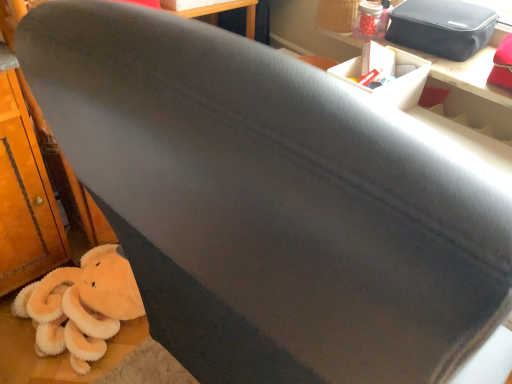
Based on the photo, in order to face white cardboard box at upper right, should I rotate leftwards or rightwards?

You should look right and rotate roughly 16.276 degrees.

At what (x,y) coordinates should I click in order to perform the action: click on matte black table at upper right. Please return your answer as a coordinate pair (x, y). Looking at the image, I should click on (466, 73).

How different are the orientations of white cardboard box at upper right and matte black table at upper right in degrees?

The facing directions of white cardboard box at upper right and matte black table at upper right are 91.3 degrees apart.

Does white cardboard box at upper right have a lesser width compared to matte black table at upper right?

Yes, white cardboard box at upper right is thinner than matte black table at upper right.

From a real-world perspective, is white cardboard box at upper right physically located above or below matte black table at upper right?

white cardboard box at upper right is situated higher than matte black table at upper right in the real world.

Is white cardboard box at upper right not near matte black table at upper right?

No, white cardboard box at upper right is not far away from matte black table at upper right.

Locate an element on the screen. table lying in front of the white cardboard box at upper right is located at coordinates (466, 73).

Can you confirm if matte black table at upper right is smaller than white cardboard box at upper right?

No, matte black table at upper right is not smaller than white cardboard box at upper right.

Is matte black table at upper right shorter than white cardboard box at upper right?

Correct, matte black table at upper right is not as tall as white cardboard box at upper right.

Is matte black table at upper right at the left side of white cardboard box at upper right?

No, matte black table at upper right is not to the left of white cardboard box at upper right.

Is white cardboard box at upper right oriented towards fluffy orange stuffed animal at lower left?

No, white cardboard box at upper right is not oriented towards fluffy orange stuffed animal at lower left.

Is white cardboard box at upper right at the right side of fluffy orange stuffed animal at lower left?

Indeed, white cardboard box at upper right is positioned on the right side of fluffy orange stuffed animal at lower left.

What's the angular difference between white cardboard box at upper right and fluffy orange stuffed animal at lower left's facing directions?

The angular difference between white cardboard box at upper right and fluffy orange stuffed animal at lower left is 97.5 degrees.

In the image, is white cardboard box at upper right positioned in front of or behind fluffy orange stuffed animal at lower left?

In the image, white cardboard box at upper right appears in front of fluffy orange stuffed animal at lower left.

This screenshot has height=384, width=512. Identify the location of table in front of the black fabric bag at upper right. (466, 73).

Is black fabric bag at upper right facing away from matte black table at upper right?

black fabric bag at upper right does not have its back to matte black table at upper right.

Considering the positions of objects black fabric bag at upper right and matte black table at upper right in the image provided, who is more to the left, black fabric bag at upper right or matte black table at upper right?

From the viewer's perspective, matte black table at upper right appears more on the left side.

From a real-world perspective, between black fabric bag at upper right and matte black table at upper right, who is vertically higher?

In real-world perspective, black fabric bag at upper right is above.

From the image's perspective, is fluffy orange stuffed animal at lower left on white cardboard box at upper right?

Actually, fluffy orange stuffed animal at lower left appears below white cardboard box at upper right in the image.

Does fluffy orange stuffed animal at lower left come in front of white cardboard box at upper right?

No, fluffy orange stuffed animal at lower left is further to the viewer.

Is fluffy orange stuffed animal at lower left completely or partially outside of white cardboard box at upper right?

That's correct, fluffy orange stuffed animal at lower left is outside of white cardboard box at upper right.

From a real-world perspective, which object rests below the other?

fluffy orange stuffed animal at lower left.

Consider the image. From a real-world perspective, is matte black table at upper right positioned over black fabric bag at upper right based on gravity?

No, from a real-world perspective, matte black table at upper right is not on top of black fabric bag at upper right.

From the image's perspective, is matte black table at upper right under black fabric bag at upper right?

Yes, from the image's perspective, matte black table at upper right is beneath black fabric bag at upper right.

Considering the relative positions of matte black table at upper right and black fabric bag at upper right in the image provided, is matte black table at upper right to the right of black fabric bag at upper right from the viewer's perspective?

Incorrect, matte black table at upper right is not on the right side of black fabric bag at upper right.

Which is less distant, (462, 89) or (428, 46)?

Point (462, 89) is closer to the camera than point (428, 46).

Considering the points (407, 52) and (462, 25), which point is in front, point (407, 52) or point (462, 25)?

The point (462, 25) is more forward.

From the picture: Is white cardboard box at upper right taller than black fabric bag at upper right?

Indeed, white cardboard box at upper right has a greater height compared to black fabric bag at upper right.

Is black fabric bag at upper right completely or partially inside white cardboard box at upper right?

That's incorrect, black fabric bag at upper right is not inside white cardboard box at upper right.

In the scene shown: Does white cardboard box at upper right turn towards black fabric bag at upper right?

No, white cardboard box at upper right is not oriented towards black fabric bag at upper right.

This screenshot has width=512, height=384. Identify the location of table that appears on the right of white cardboard box at upper right. (466, 73).

The height and width of the screenshot is (384, 512). I want to click on box to the left of matte black table at upper right, so click(x=391, y=83).

Considering their positions, is white cardboard box at upper right positioned closer to matte black table at upper right than black fabric bag at upper right?

black fabric bag at upper right is positioned closer to the anchor matte black table at upper right.

Looking at the image, which one is located further to white cardboard box at upper right, matte black table at upper right or fluffy orange stuffed animal at lower left?

The object further to white cardboard box at upper right is fluffy orange stuffed animal at lower left.

Based on their spatial positions, is fluffy orange stuffed animal at lower left or white cardboard box at upper right further from black fabric bag at upper right?

The object further to black fabric bag at upper right is fluffy orange stuffed animal at lower left.

Considering their positions, is matte black table at upper right positioned closer to white cardboard box at upper right than black fabric bag at upper right?

Based on the image, matte black table at upper right appears to be nearer to white cardboard box at upper right.

Based on their spatial positions, is fluffy orange stuffed animal at lower left or white cardboard box at upper right further from matte black table at upper right?

Based on the image, fluffy orange stuffed animal at lower left appears to be further to matte black table at upper right.

Looking at the image, which one is located further to black fabric bag at upper right, matte black table at upper right or fluffy orange stuffed animal at lower left?

fluffy orange stuffed animal at lower left is further to black fabric bag at upper right.

When comparing their distances from fluffy orange stuffed animal at lower left, does matte black table at upper right or black fabric bag at upper right seem closer?

matte black table at upper right is positioned closer to the anchor fluffy orange stuffed animal at lower left.

Which object lies further to the anchor point black fabric bag at upper right, matte black table at upper right or white cardboard box at upper right?

The object further to black fabric bag at upper right is white cardboard box at upper right.

Where is `table between white cardboard box at upper right and black fabric bag at upper right`? The width and height of the screenshot is (512, 384). table between white cardboard box at upper right and black fabric bag at upper right is located at coordinates (466, 73).

This screenshot has width=512, height=384. I want to click on box situated between fluffy orange stuffed animal at lower left and black fabric bag at upper right from left to right, so click(391, 83).

Locate an element on the screen. The image size is (512, 384). table between fluffy orange stuffed animal at lower left and black fabric bag at upper right in the horizontal direction is located at coordinates [x=466, y=73].

The height and width of the screenshot is (384, 512). What are the coordinates of `box located between fluffy orange stuffed animal at lower left and matte black table at upper right in the left-right direction` in the screenshot? It's located at (391, 83).